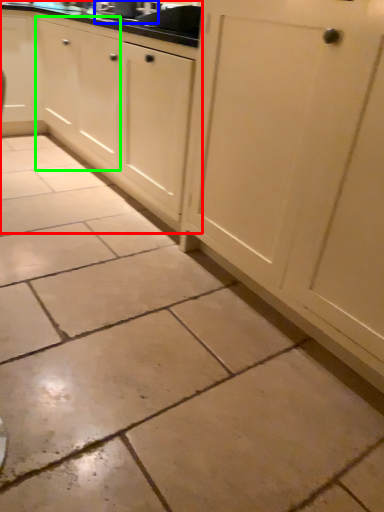
Question: Based on their relative distances, which object is nearer to cabinetry (highlighted by a red box)? Choose from sink (highlighted by a blue box) and cabinetry (highlighted by a green box).

Choices:
 (A) sink
 (B) cabinetry

Answer: (B)